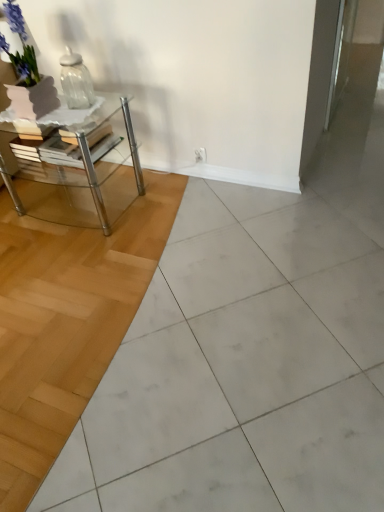
Question: Should I look upward or downward to see clear glass jar at upper left?

Choices:
 (A) up
 (B) down

Answer: (A)

Question: From the image's perspective, does clear glass table at left appear higher than white glossy ceramic tile at center?

Choices:
 (A) no
 (B) yes

Answer: (A)

Question: From a real-world perspective, is clear glass table at left beneath white glossy ceramic tile at center?

Choices:
 (A) yes
 (B) no

Answer: (B)

Question: Is clear glass table at left smaller than white glossy ceramic tile at center?

Choices:
 (A) yes
 (B) no

Answer: (A)

Question: Considering the relative sizes of clear glass table at left and white glossy ceramic tile at center in the image provided, is clear glass table at left shorter than white glossy ceramic tile at center?

Choices:
 (A) yes
 (B) no

Answer: (B)

Question: From the image's perspective, does clear glass table at left appear lower than white glossy ceramic tile at center?

Choices:
 (A) yes
 (B) no

Answer: (A)

Question: From a real-world perspective, is clear glass table at left on white glossy ceramic tile at center?

Choices:
 (A) yes
 (B) no

Answer: (A)

Question: Is white glossy ceramic tile at center positioned behind matte glass vase at upper left?

Choices:
 (A) yes
 (B) no

Answer: (B)

Question: Is white glossy ceramic tile at center taller than matte glass vase at upper left?

Choices:
 (A) yes
 (B) no

Answer: (B)

Question: From the image's perspective, would you say white glossy ceramic tile at center is shown under matte glass vase at upper left?

Choices:
 (A) no
 (B) yes

Answer: (B)

Question: Considering the relative sizes of white glossy ceramic tile at center and matte glass vase at upper left in the image provided, is white glossy ceramic tile at center thinner than matte glass vase at upper left?

Choices:
 (A) no
 (B) yes

Answer: (A)

Question: Is white glossy ceramic tile at center aimed at matte glass vase at upper left?

Choices:
 (A) yes
 (B) no

Answer: (B)

Question: Considering the relative positions of white glossy ceramic tile at center and matte glass vase at upper left in the image provided, is white glossy ceramic tile at center to the left of matte glass vase at upper left from the viewer's perspective?

Choices:
 (A) no
 (B) yes

Answer: (A)

Question: Does white glossy ceramic tile at center come behind clear glass table at left?

Choices:
 (A) no
 (B) yes

Answer: (A)